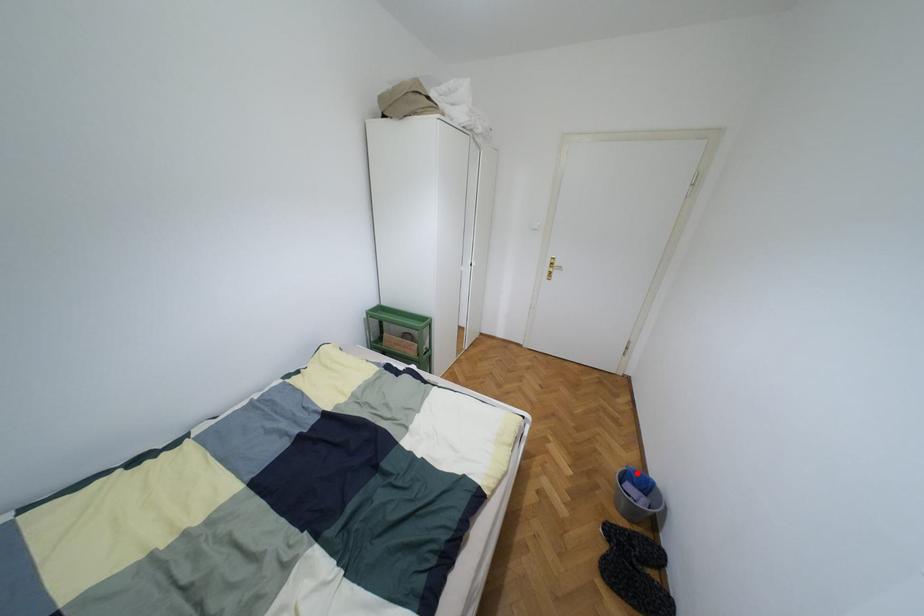
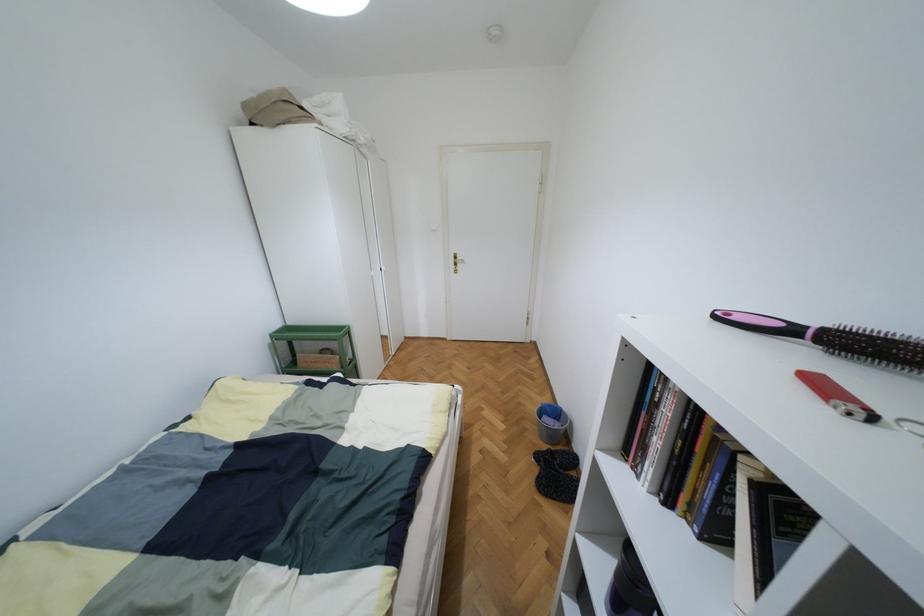
In the second image, find the point that corresponds to the highlighted location in the first image.

(549, 406)